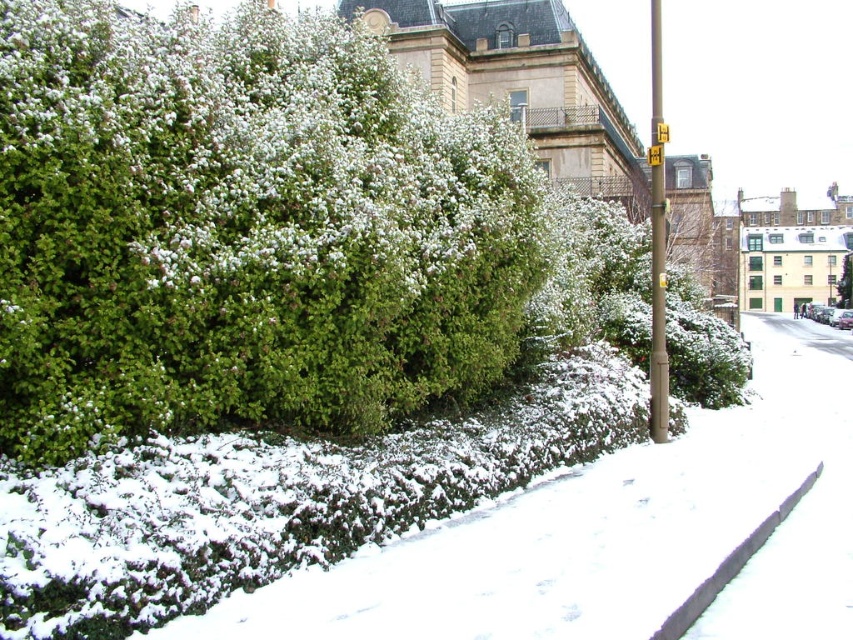
Question: Among these objects, which one is nearest to the camera?

Choices:
 (A) brown metallic pole at right
 (B) black rubber curb at lower right
 (C) green matte bush at center
 (D) green leafy bush at center

Answer: (D)

Question: Where is green leafy bush at center located in relation to green matte bush at center in the image?

Choices:
 (A) left
 (B) right

Answer: (A)

Question: Which point is closer to the camera?

Choices:
 (A) 657,164
 (B) 755,552
 (C) 660,332

Answer: (B)

Question: Can you confirm if black rubber curb at lower right is wider than metallic rectangular at upper right?

Choices:
 (A) yes
 (B) no

Answer: (B)

Question: From the image, what is the correct spatial relationship of green leafy bush at center in relation to brown metallic pole at right?

Choices:
 (A) right
 (B) left

Answer: (B)

Question: Based on their relative distances, which object is nearer to the green matte bush at center?

Choices:
 (A) black rubber curb at lower right
 (B) brown metallic pole at right

Answer: (B)